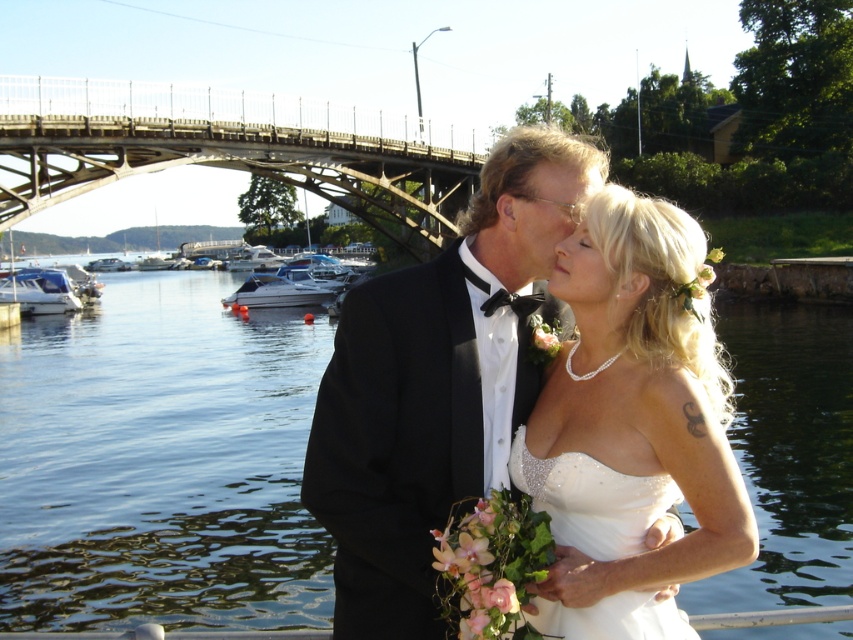
Question: Is black satin tuxedo at center thinner than white glossy boat at left?

Choices:
 (A) no
 (B) yes

Answer: (B)

Question: Is white satin cocktail dress at center below white glossy boat at center?

Choices:
 (A) no
 (B) yes

Answer: (B)

Question: Is white glossy boat at center above white glossy boat at left?

Choices:
 (A) no
 (B) yes

Answer: (B)

Question: Which point is closer to the camera?

Choices:
 (A) coord(312,164)
 (B) coord(39,292)
 (C) coord(525,195)

Answer: (C)

Question: Which object is positioned farthest from the black satin tuxedo at center?

Choices:
 (A) matte black hair at upper center
 (B) white glossy boat at left

Answer: (B)

Question: Among these points, which one is nearest to the camera?

Choices:
 (A) (44, 548)
 (B) (300, 300)

Answer: (A)